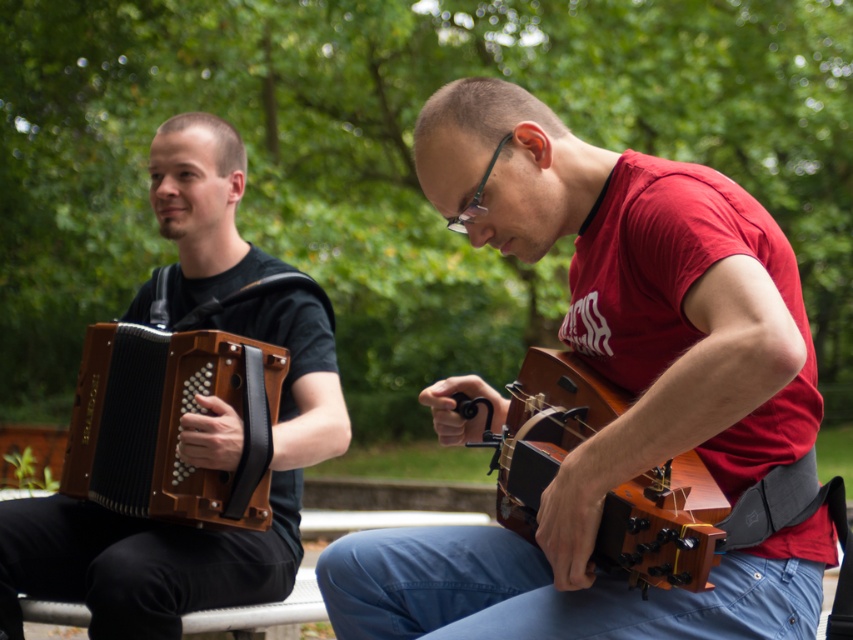
Question: Can you confirm if wooden acoustic guitar at center is wider than matte brown accordion at left?

Choices:
 (A) yes
 (B) no

Answer: (B)

Question: Can you confirm if matte brown accordion at left is thinner than brown wooden accordion at left?

Choices:
 (A) yes
 (B) no

Answer: (B)

Question: Which point is farther to the camera?

Choices:
 (A) (618, 397)
 (B) (25, 561)
 (C) (647, 428)
 (D) (152, 381)

Answer: (B)

Question: Where is wooden acoustic guitar at center located in relation to brown wooden accordion at left in the image?

Choices:
 (A) below
 (B) above

Answer: (B)

Question: Estimate the real-world distances between objects in this image. Which object is farther from the wooden acoustic guitar at center?

Choices:
 (A) wooden guitar at center
 (B) matte brown accordion at left
 (C) brown wooden accordion at left

Answer: (B)

Question: Which point is farther from the camera taking this photo?

Choices:
 (A) (108, 429)
 (B) (143, 531)
 (C) (793, 298)
 (D) (521, 364)

Answer: (D)